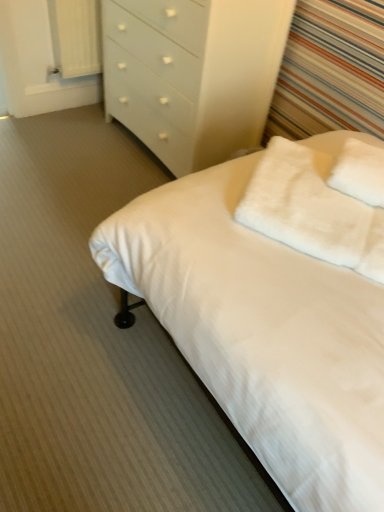
Where is `empty space that is ontop of white soft bed at center (from a real-world perspective)`? empty space that is ontop of white soft bed at center (from a real-world perspective) is located at coordinates (77, 267).